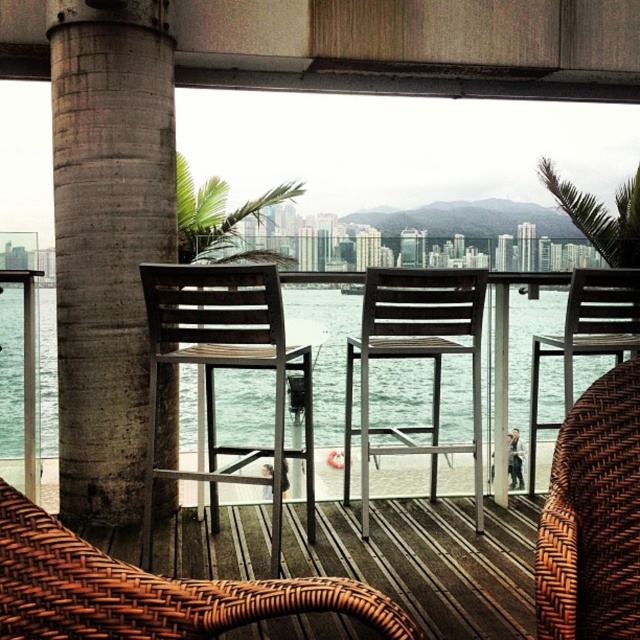
You are standing on the balcony and want to sit down to enjoy the view. If you choose the brown woven armchair at lower left, will you be sitting higher than the brown woven chair at center?

The brown woven armchair at lower left is located above the brown woven chair at center, so yes, you will be sitting higher in the brown woven armchair at lower left compared to the brown woven chair at center.

You are standing on the balcony and want to place a small potted plant between the two points marked as point (342,474) and point (584,305). Which point should the plant be closer to in order to be closer to the railing?

The plant should be closer to point (584,305) because it is farther from the viewer compared to point (342,474), meaning it is nearer to the railing.

In the scene shown: You are standing on the balcony and want to pour water from a pitcher into the clear water at table center. To ensure accuracy, what are the exact coordinates where you should aim?

The clear water at table center is located at coordinates point (324, 349), so you should aim for that exact point.